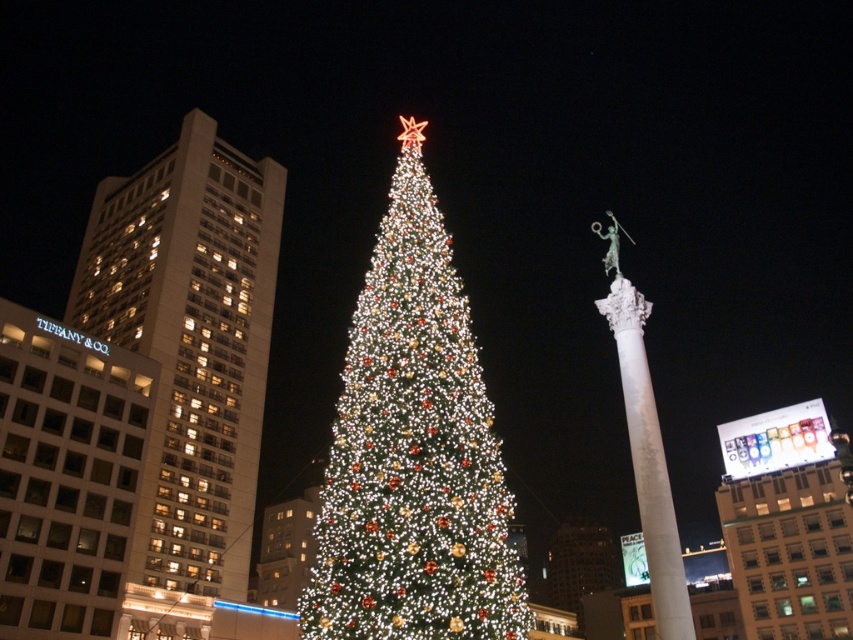
You are standing in the city square where the Christmas tree is the central attraction. You want to take a photo of the point at coordinates point (410, 317). If your camera has a maximum focus range of 40 meters, will you be able to capture it clearly?

The point at coordinates point (410, 317) is 39.83 meters away from the camera, which is within the 40 meters maximum focus range. Therefore, you can capture it clearly.

Consider the image. You are standing in the city square and want to take a photo of the illuminated green christmas tree at center. If you are positioned at point 0.5, 0.5, which direction should you move to get the tree in your camera frame?

Since the illuminated green christmas tree at center is located at point (413, 452), you should move to the right and slightly downward from your current position at (426, 320) to center the tree in your camera frame.